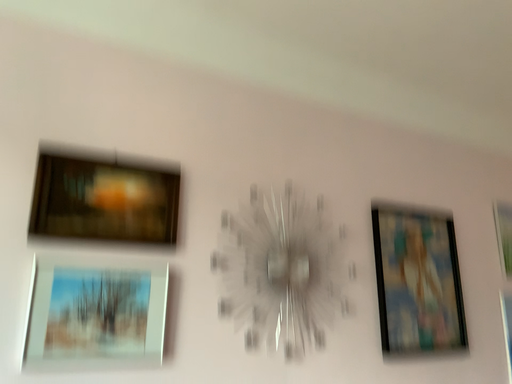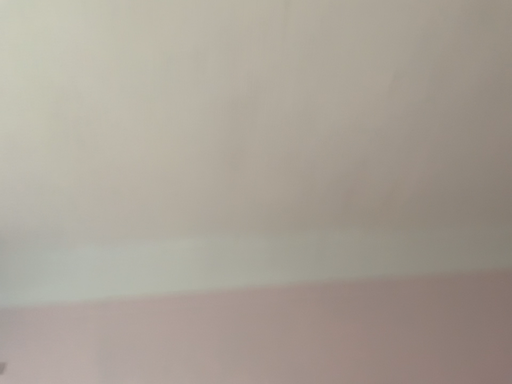
Question: How did the camera likely rotate when shooting the video?

Choices:
 (A) rotated upward
 (B) rotated downward

Answer: (A)